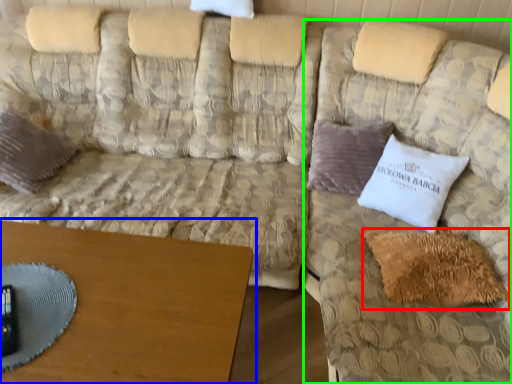
Question: Based on their relative distances, which object is farther from pillow (highlighted by a red box)? Choose from table (highlighted by a blue box) and couch (highlighted by a green box).

Choices:
 (A) table
 (B) couch

Answer: (A)